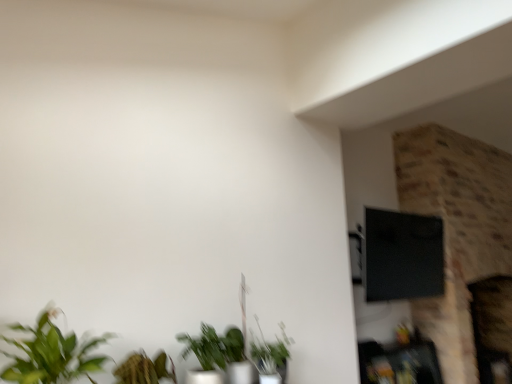
Question: Which direction should I rotate to face green matte plant at lower center, the second houseplant in the front-to-back sequence, — up or down?

Choices:
 (A) up
 (B) down

Answer: (B)

Question: Is green leafy plant at lower left, which is the 1th houseplant in left-to-right order, to the left of green matte plant at lower center, the third houseplant viewed from the front, from the viewer's perspective?

Choices:
 (A) no
 (B) yes

Answer: (B)

Question: Would you say green matte plant at lower center, the 1th houseplant positioned from the back, is part of green leafy plant at lower left, the first houseplant viewed from the front,'s contents?

Choices:
 (A) yes
 (B) no

Answer: (B)

Question: Does green leafy plant at lower left, which is the 1th houseplant in left-to-right order, lie in front of green matte plant at lower center, the third houseplant positioned from the left?

Choices:
 (A) no
 (B) yes

Answer: (B)

Question: Does green leafy plant at lower left, which appears as the 3th houseplant when viewed from the back, appear on the right side of green matte plant at lower center, which appears as the first houseplant when viewed from the right?

Choices:
 (A) no
 (B) yes

Answer: (A)

Question: Could you tell me if green leafy plant at lower left, which is the third houseplant in right-to-left order, is facing green matte plant at lower center, the 1th houseplant positioned from the back?

Choices:
 (A) yes
 (B) no

Answer: (B)

Question: From a real-world perspective, is green leafy plant at lower left, which is the 1th houseplant in left-to-right order, positioned over green matte plant at lower center, the third houseplant viewed from the front, based on gravity?

Choices:
 (A) no
 (B) yes

Answer: (B)

Question: Can you confirm if green leafy plant at lower left, which is the third houseplant in right-to-left order, is smaller than green matte plant at lower center, the second houseplant in the front-to-back sequence?

Choices:
 (A) no
 (B) yes

Answer: (A)

Question: Is green leafy plant at lower left, which appears as the 3th houseplant when viewed from the back, in front of green matte plant at lower center, the 2th houseplant viewed from the back?

Choices:
 (A) no
 (B) yes

Answer: (B)

Question: Does green leafy plant at lower left, which appears as the 3th houseplant when viewed from the back, have a larger size compared to green matte plant at lower center, positioned as the second houseplant in left-to-right order?

Choices:
 (A) yes
 (B) no

Answer: (A)

Question: From the image's perspective, does green leafy plant at lower left, which appears as the 3th houseplant when viewed from the back, appear higher than green matte plant at lower center, arranged as the 2th houseplant when viewed from the right?

Choices:
 (A) no
 (B) yes

Answer: (B)

Question: Is green leafy plant at lower left, which is the 1th houseplant in left-to-right order, turned away from green matte plant at lower center, the second houseplant in the front-to-back sequence?

Choices:
 (A) no
 (B) yes

Answer: (A)

Question: Considering the relative sizes of green leafy plant at lower left, the first houseplant viewed from the front, and green matte plant at lower center, the second houseplant in the front-to-back sequence, in the image provided, is green leafy plant at lower left, the first houseplant viewed from the front, thinner than green matte plant at lower center, the second houseplant in the front-to-back sequence,?

Choices:
 (A) yes
 (B) no

Answer: (B)

Question: Considering the relative sizes of wooden shelf at lower right and green matte plant at lower center, which appears as the first houseplant when viewed from the right, in the image provided, is wooden shelf at lower right thinner than green matte plant at lower center, which appears as the first houseplant when viewed from the right,?

Choices:
 (A) yes
 (B) no

Answer: (B)